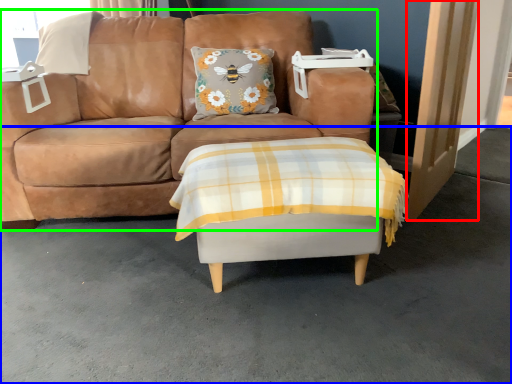
Question: Which object is positioned closest to door (highlighted by a red box)? Select from concrete (highlighted by a blue box) and studio couch (highlighted by a green box).

Choices:
 (A) concrete
 (B) studio couch

Answer: (A)